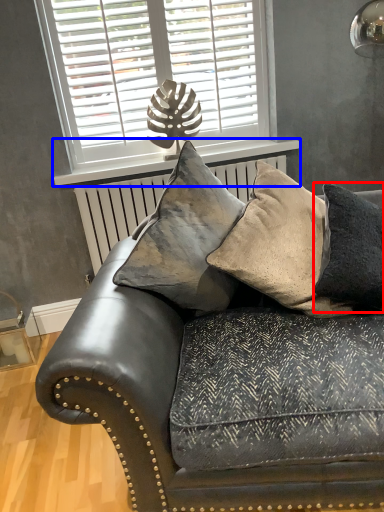
Question: Among these objects, which one is nearest to the camera, pillow (highlighted by a red box) or window sill (highlighted by a blue box)?

Choices:
 (A) pillow
 (B) window sill

Answer: (A)